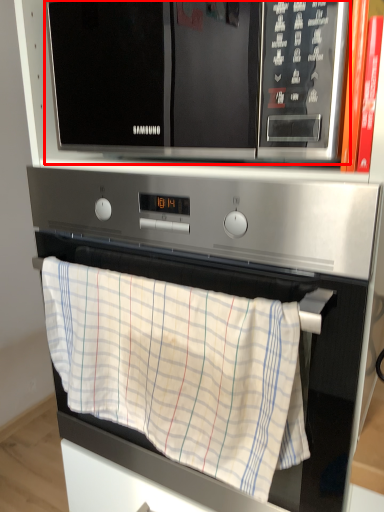
Question: From the image, what is the correct spatial relationship of microwave oven (annotated by the red box) in relation to oven?

Choices:
 (A) right
 (B) left

Answer: (B)